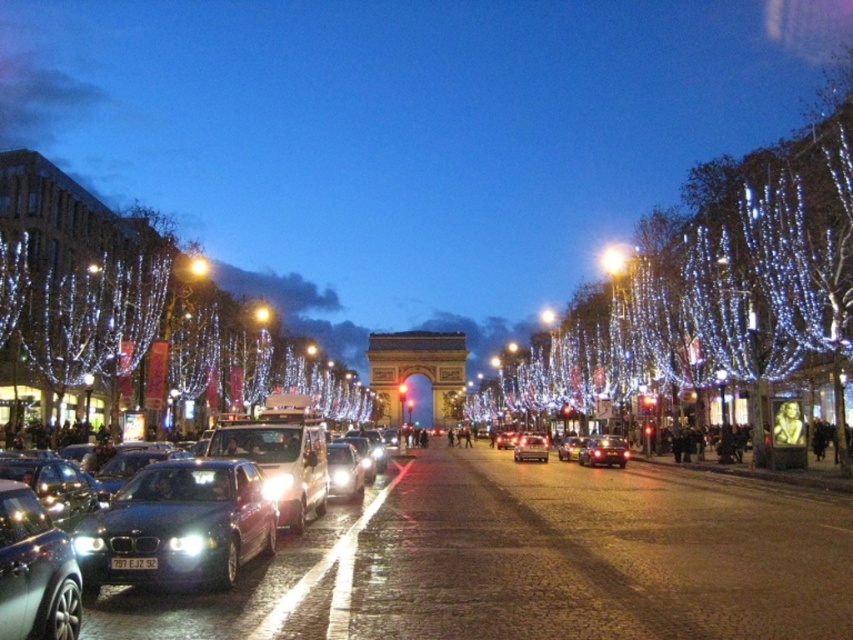
Question: In this image, where is sleek metallic car at center located relative to shiny silver car at center?

Choices:
 (A) right
 (B) left

Answer: (B)

Question: Which of the following is the farthest from the observer?

Choices:
 (A) shiny silver car at lower left
 (B) satin silver sedan at center
 (C) illuminated wire at left

Answer: (B)

Question: Which is farther from the illuminated wire at center?

Choices:
 (A) sleek metallic car at left
 (B) shiny silver car at lower left
 (C) shiny silver car at center
 (D) satin silver sedan at center

Answer: (B)

Question: Can you confirm if shiny silver car at lower left is positioned above shiny silver car at center?

Choices:
 (A) yes
 (B) no

Answer: (A)

Question: Is shiny silver car at center in front of bright yellow streetlight at center?

Choices:
 (A) no
 (B) yes

Answer: (B)

Question: Among these objects, which one is nearest to the camera?

Choices:
 (A) illuminated wire at center
 (B) sleek metallic car at left
 (C) sleek metallic car at center

Answer: (C)